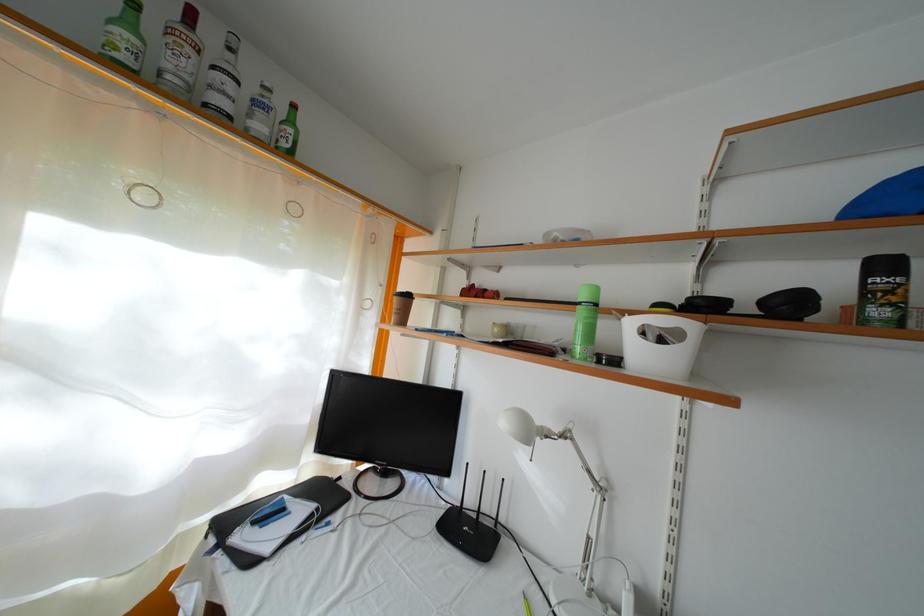
At what (x,y) coordinates should I click in order to perform the action: click on desk lamp joint. Please return your answer as a coordinate pair (x, y). The width and height of the screenshot is (924, 616). Looking at the image, I should click on click(518, 426).